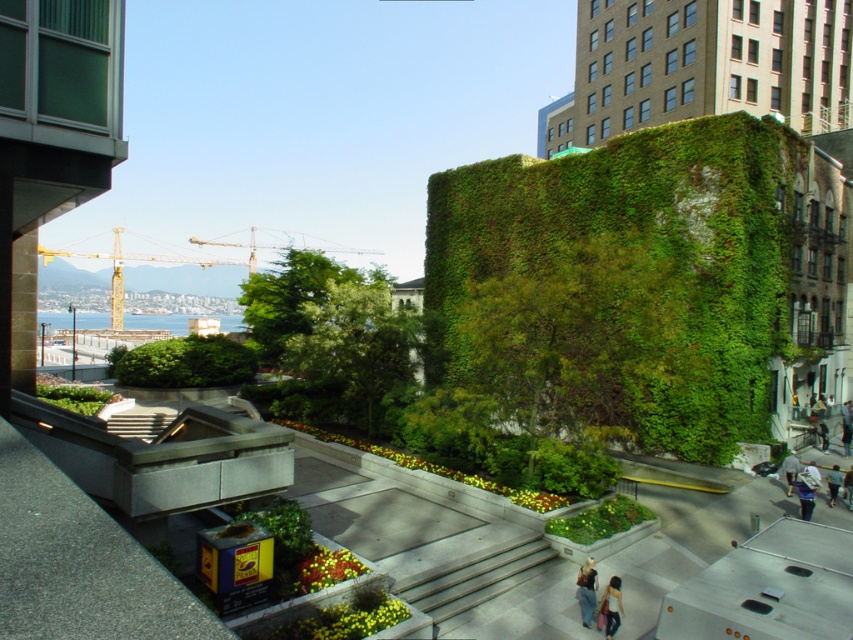
Question: Is light beige fabric bag at lower right thinner than light blue fabric backpack at lower right?

Choices:
 (A) yes
 (B) no

Answer: (A)

Question: Which object is closer to the camera taking this photo?

Choices:
 (A) dark brown leather jacket at lower right
 (B) dark gray pants at lower right
 (C) denim jacket at lower center

Answer: (C)

Question: Can you confirm if green leafy tree at center is positioned to the left of dark brown leather jacket at lower right?

Choices:
 (A) yes
 (B) no

Answer: (A)

Question: Is green leafy tree at center further to camera compared to light blue jeans at lower right?

Choices:
 (A) no
 (B) yes

Answer: (B)

Question: Which object appears closest to the camera in this image?

Choices:
 (A) green leafy tree at center
 (B) dark gray pants at lower right
 (C) dark brown leather jacket at lower right

Answer: (C)

Question: Which of the following is the closest to the observer?

Choices:
 (A) (828, 497)
 (B) (312, 312)
 (C) (585, 561)

Answer: (C)